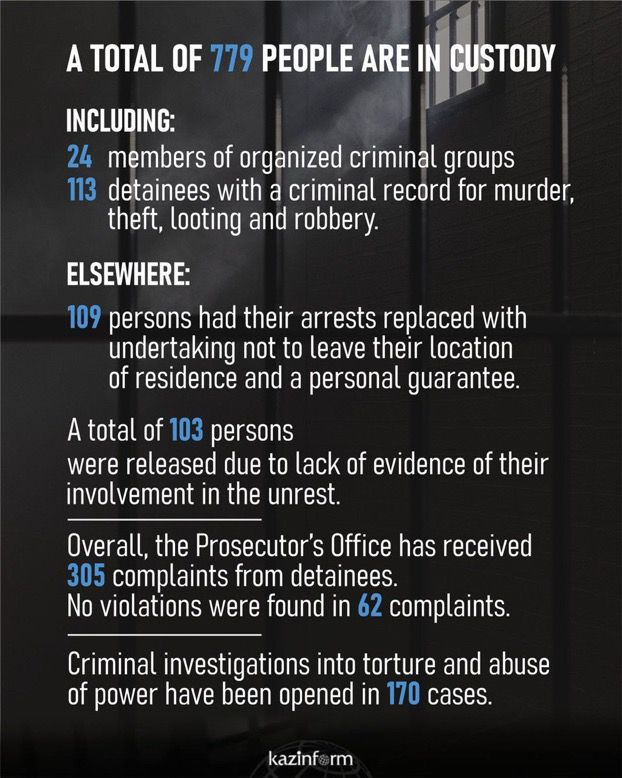
This screenshot has width=622, height=778. In order to click on light in this screenshot , I will do `click(346, 117)`.